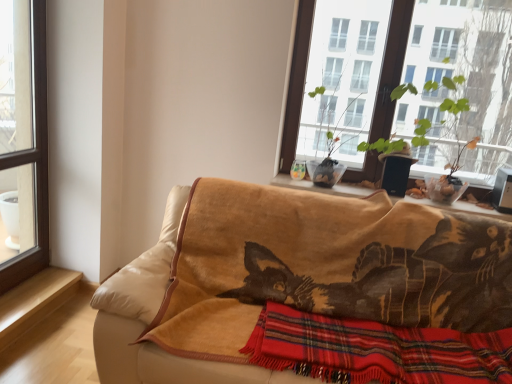
Question: Is transparent glass window at left, which is counted as the 2th window, starting from the right, thinner than light brown wood at lower left, the 2th window sill positioned from the right?

Choices:
 (A) no
 (B) yes

Answer: (B)

Question: Does transparent glass window at left, the first window from the left, have a larger size compared to light brown wood at lower left, positioned as the second window sill in top-to-bottom order?

Choices:
 (A) yes
 (B) no

Answer: (A)

Question: From the image's perspective, is transparent glass window at left, the first window from the left, over light brown wood at lower left, the 2th window sill positioned from the right?

Choices:
 (A) no
 (B) yes

Answer: (B)

Question: Can you confirm if transparent glass window at left, the first window from the left, is positioned to the left of light brown wood at lower left, which ranks as the first window sill in bottom-to-top order?

Choices:
 (A) no
 (B) yes

Answer: (A)

Question: Can you confirm if transparent glass window at left, which is counted as the 2th window, starting from the right, is taller than light brown wood at lower left, positioned as the second window sill in top-to-bottom order?

Choices:
 (A) no
 (B) yes

Answer: (B)

Question: Considering their positions, is transparent glass window at left, the first window from the left, located in front of or behind green leafy plant at upper right?

Choices:
 (A) behind
 (B) front

Answer: (B)

Question: In terms of width, does transparent glass window at left, which is counted as the 2th window, starting from the right, look wider or thinner when compared to green leafy plant at upper right?

Choices:
 (A) thin
 (B) wide

Answer: (A)

Question: In terms of height, does transparent glass window at left, which is counted as the 2th window, starting from the right, look taller or shorter compared to green leafy plant at upper right?

Choices:
 (A) short
 (B) tall

Answer: (B)

Question: Based on their positions, is transparent glass window at left, which is counted as the 2th window, starting from the right, located to the left or right of green leafy plant at upper right?

Choices:
 (A) left
 (B) right

Answer: (A)

Question: Would you say light brown wood at lower left, positioned as the second window sill in top-to-bottom order, is inside or outside green leafy plant at upper right?

Choices:
 (A) outside
 (B) inside

Answer: (A)

Question: From the image's perspective, is light brown wood at lower left, the 2th window sill positioned from the right, positioned above or below green leafy plant at upper right?

Choices:
 (A) below
 (B) above

Answer: (A)

Question: In the image, is light brown wood at lower left, which ranks as the first window sill in bottom-to-top order, positioned in front of or behind green leafy plant at upper right?

Choices:
 (A) behind
 (B) front

Answer: (A)

Question: Is light brown wood at lower left, the 1th window sill in the left-to-right sequence, wider or thinner than green leafy plant at upper right?

Choices:
 (A) wide
 (B) thin

Answer: (B)

Question: Is point (306, 79) closer or farther from the camera than point (359, 190)?

Choices:
 (A) closer
 (B) farther

Answer: (B)

Question: Is transparent glass window at upper center, which is the first window from right to left, inside or outside of wooden window sill at center, positioned as the 1th window sill in right-to-left order?

Choices:
 (A) inside
 (B) outside

Answer: (B)